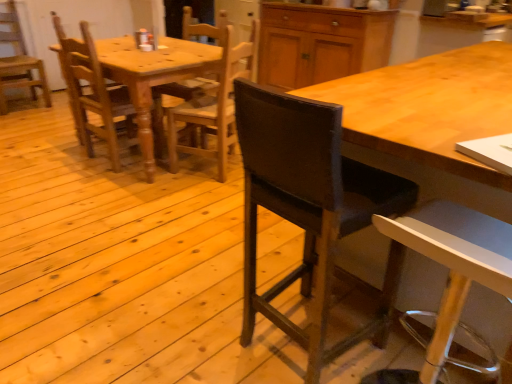
Question: Would you consider matte wood cabinet at upper center to be distant from wooden chair at left, placed as the 1th chair when sorted from left to right?

Choices:
 (A) yes
 (B) no

Answer: (A)

Question: Can you confirm if matte wood cabinet at upper center is wider than wooden chair at left, placed as the 1th chair when sorted from left to right?

Choices:
 (A) yes
 (B) no

Answer: (A)

Question: Does matte wood cabinet at upper center have a smaller size compared to wooden chair at left, the 1th chair in the back-to-front sequence?

Choices:
 (A) yes
 (B) no

Answer: (B)

Question: Is matte wood cabinet at upper center thinner than wooden chair at left, the 5th chair viewed from the front?

Choices:
 (A) no
 (B) yes

Answer: (A)

Question: Is matte wood cabinet at upper center facing away from wooden chair at left, the 1th chair in the back-to-front sequence?

Choices:
 (A) yes
 (B) no

Answer: (B)

Question: Does matte wood cabinet at upper center turn towards wooden chair at left, placed as the 1th chair when sorted from left to right?

Choices:
 (A) no
 (B) yes

Answer: (A)

Question: Is wooden chair at left, the 5th chair viewed from the front, in contact with wooden chair at center, the 3th chair positioned from the left?

Choices:
 (A) no
 (B) yes

Answer: (A)

Question: Could you tell me if wooden chair at left, the 1th chair in the back-to-front sequence, is facing wooden chair at center, acting as the 3th chair starting from the right?

Choices:
 (A) no
 (B) yes

Answer: (B)

Question: Is wooden chair at center, the third chair positioned from the front, inside wooden chair at left, placed as the 1th chair when sorted from left to right?

Choices:
 (A) no
 (B) yes

Answer: (A)

Question: Can you confirm if wooden chair at left, placed as the 5th chair when sorted from right to left, is shorter than wooden chair at center, the 3th chair positioned from the left?

Choices:
 (A) no
 (B) yes

Answer: (B)

Question: Is wooden chair at left, the 1th chair in the back-to-front sequence, facing away from wooden chair at center, the 3th chair positioned from the left?

Choices:
 (A) no
 (B) yes

Answer: (A)

Question: Can you confirm if wooden chair at left, the 1th chair in the back-to-front sequence, is positioned to the left of wooden chair at center, the third chair positioned from the front?

Choices:
 (A) no
 (B) yes

Answer: (B)

Question: Is wooden desk at center positioned behind wooden chair at left, the 1th chair in the back-to-front sequence?

Choices:
 (A) yes
 (B) no

Answer: (B)